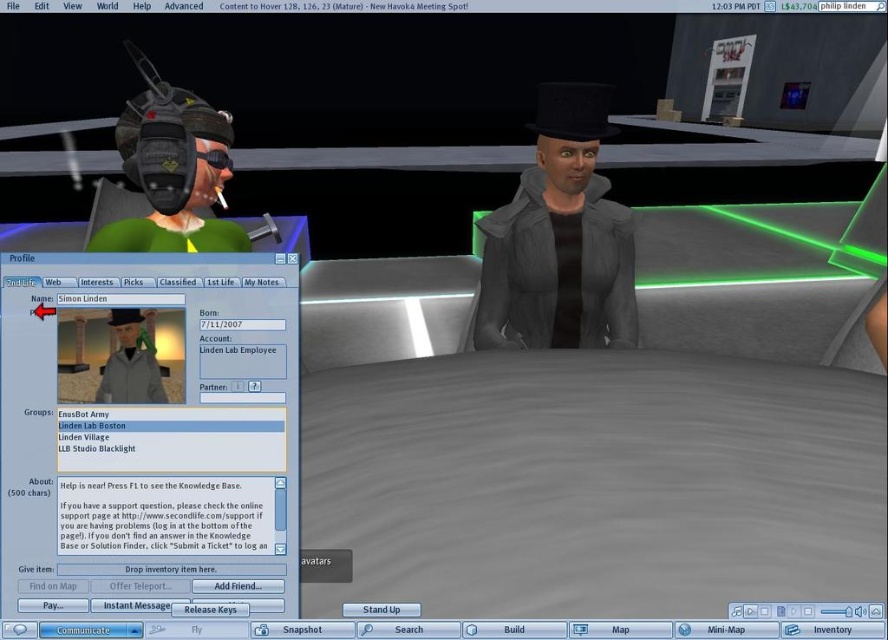
You are an avatar in this futuristic room and want to check your profile details. The matte gray profile window at center left and the gray matte jacket at center are both in your view. Which object is taller?

The matte gray profile window at center left is taller than the gray matte jacket at center.

You are navigating a virtual environment and need to interact with both the matte gray profile window at center left and the gray matte jacket at center. Which object is closer to you?

The matte gray profile window at center left is closer to the viewer than the gray matte jacket at center.